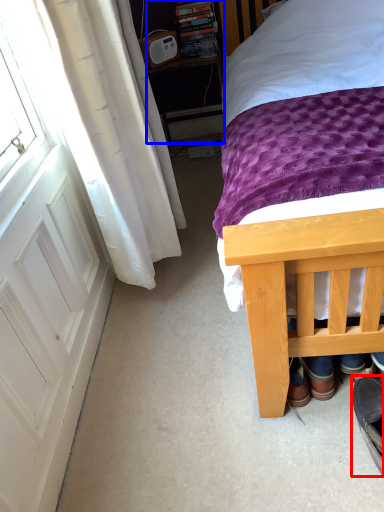
Question: Which object appears farthest to the camera in this image, footwear (highlighted by a red box) or nightstand (highlighted by a blue box)?

Choices:
 (A) footwear
 (B) nightstand

Answer: (B)